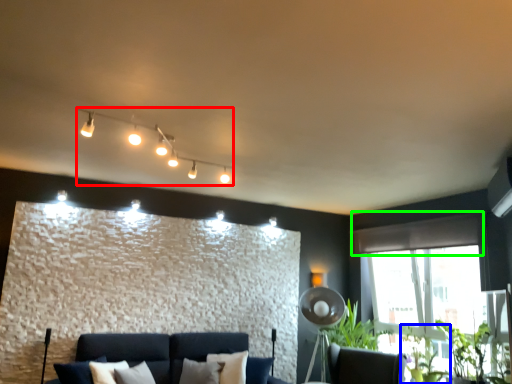
Question: Which object is positioned farthest from lamp (highlighted by a red box)? Select from plant (highlighted by a blue box) and curtain (highlighted by a green box).

Choices:
 (A) plant
 (B) curtain

Answer: (A)